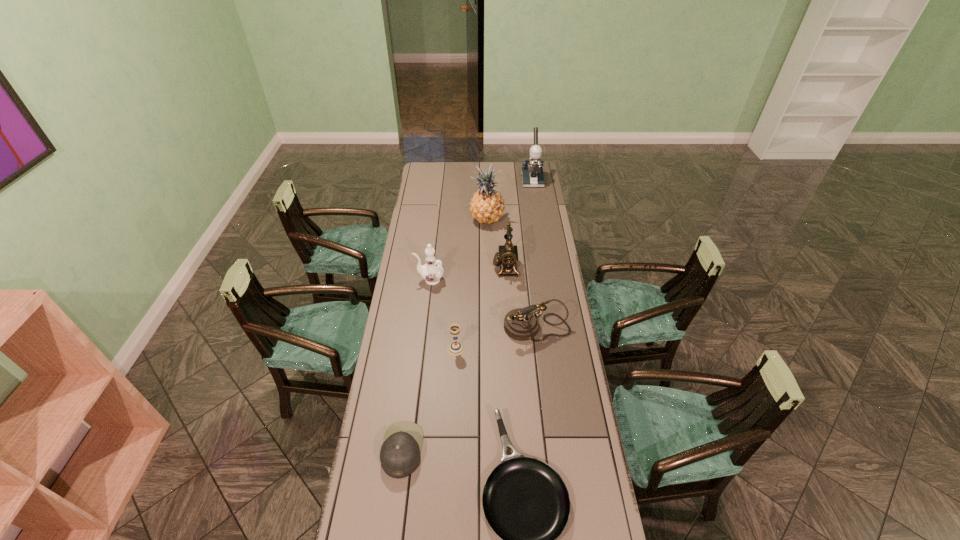
Identify the location of microscope. (532, 175).

The height and width of the screenshot is (540, 960). Find the location of `the second farthest object`. the second farthest object is located at coordinates (487, 205).

Identify the location of the taller telephone. (508, 253).

Image resolution: width=960 pixels, height=540 pixels. What are the coordinates of `chinaware` in the screenshot? It's located at (431, 272).

Identify the location of the shorter telephone. The width and height of the screenshot is (960, 540). (521, 324).

This screenshot has height=540, width=960. What are the coordinates of `the sixth tallest object` in the screenshot? It's located at (455, 348).

This screenshot has width=960, height=540. Find the location of `chalice`. chalice is located at coordinates (455, 348).

Identify the location of cap. (400, 453).

Locate an element on the screen. This screenshot has width=960, height=540. vacant area situated 0.300m on the front of the microscope is located at coordinates (539, 218).

At what (x,y) coordinates should I click in order to perform the action: click on free space located on the right of the second farthest object. Please return your answer as a coordinate pair (x, y). This screenshot has height=540, width=960. Looking at the image, I should click on (542, 220).